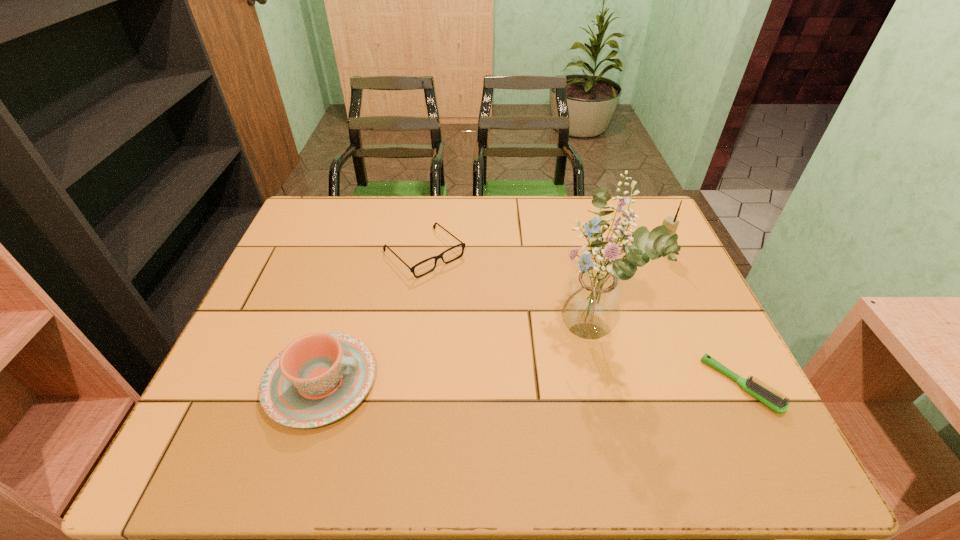
The width and height of the screenshot is (960, 540). I want to click on blank space located 0.050m on the front-facing side of the third object from right to left, so click(x=546, y=366).

The height and width of the screenshot is (540, 960). What are the coordinates of `free space located 0.340m on the front-facing side of the spectacles` in the screenshot? It's located at (533, 353).

You are a GUI agent. You are given a task and a screenshot of the screen. Output one action in this format:
    pyautogui.click(x=<x>, y=<y>)
    Task: Click on the free point located 0.170m on the front-facing side of the spectacles
    The width and height of the screenshot is (960, 540).
    Given the screenshot: What is the action you would take?
    pyautogui.click(x=487, y=310)

The height and width of the screenshot is (540, 960). Find the location of `free space located 0.130m on the front-facing side of the spectacles`. free space located 0.130m on the front-facing side of the spectacles is located at coordinates (477, 301).

At what (x,y) coordinates should I click in order to perform the action: click on free space located 0.120m on the front of the fourth shortest object, where the keypad is located. Please return your answer as a coordinate pair (x, y). The image size is (960, 540). Looking at the image, I should click on (633, 273).

In order to click on blank area located on the front of the fourth shortest object, where the keypad is located in this screenshot , I will do `click(592, 305)`.

The height and width of the screenshot is (540, 960). What are the coordinates of `vacant region located 0.260m on the front of the fourth shortest object, where the keypad is located` in the screenshot? It's located at (602, 297).

You are a GUI agent. You are given a task and a screenshot of the screen. Output one action in this format:
    pyautogui.click(x=<x>, y=<y>)
    Task: Click on the object situated at the far edge
    The height and width of the screenshot is (540, 960).
    Given the screenshot: What is the action you would take?
    pyautogui.click(x=412, y=269)

Image resolution: width=960 pixels, height=540 pixels. Find the location of `chinaware located in the near edge section of the desktop`. chinaware located in the near edge section of the desktop is located at coordinates (319, 378).

What are the coordinates of `hairbrush that is at the near edge` in the screenshot? It's located at (772, 400).